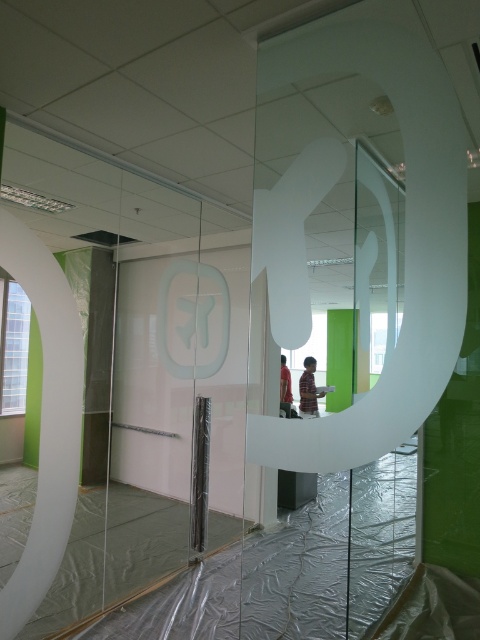
You are an interior designer observing the office space. You notice the white frosted glass logo at center and the striped shirt at center. Which object is taller?

The white frosted glass logo at center is taller than the striped shirt at center.

You are an interior designer observing the office scene. You notice the white frosted glass logo at center and the matte black shirt at center. Which object is located more to the left?

The white frosted glass logo at center is positioned on the left side of the matte black shirt at center, so it is more to the left.

You are an interior designer observing the office space. You notice the white frosted glass logo at center and the matte black shirt at center. Which object appears larger in the scene?

The matte black shirt at center appears larger because the white frosted glass logo at center is smaller in size compared to it.